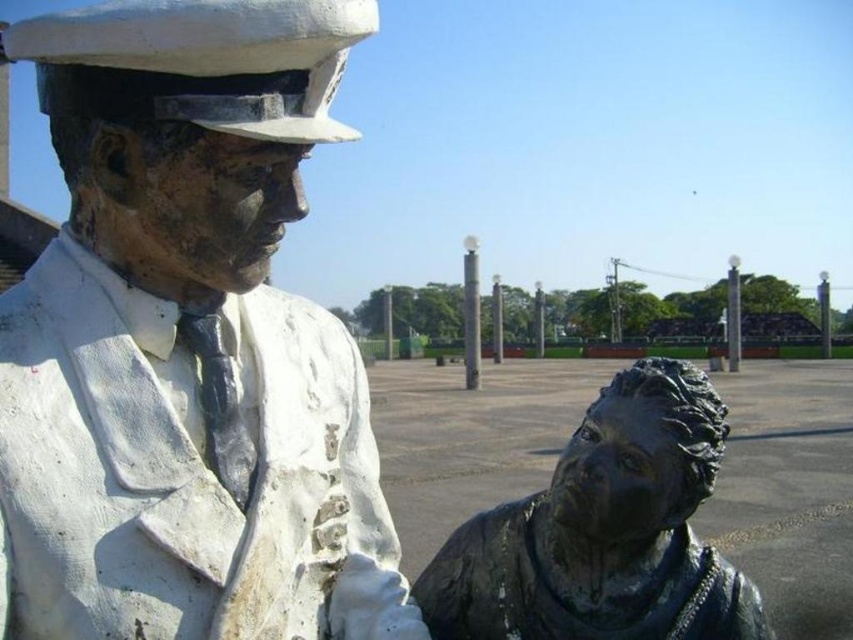
Question: Which point is farther to the camera?

Choices:
 (A) bronze statue at left
 (B) bronze statue at lower right

Answer: (B)

Question: Among these objects, which one is nearest to the camera?

Choices:
 (A) bronze statue at left
 (B) bronze statue at lower right

Answer: (A)

Question: Does bronze statue at left come in front of bronze statue at lower right?

Choices:
 (A) yes
 (B) no

Answer: (A)

Question: Is bronze statue at left positioned before bronze statue at lower right?

Choices:
 (A) yes
 (B) no

Answer: (A)

Question: Can you confirm if bronze statue at left is positioned to the right of bronze statue at lower right?

Choices:
 (A) no
 (B) yes

Answer: (A)

Question: Which object is closer to the camera taking this photo?

Choices:
 (A) bronze statue at left
 (B) bronze statue at lower right

Answer: (A)